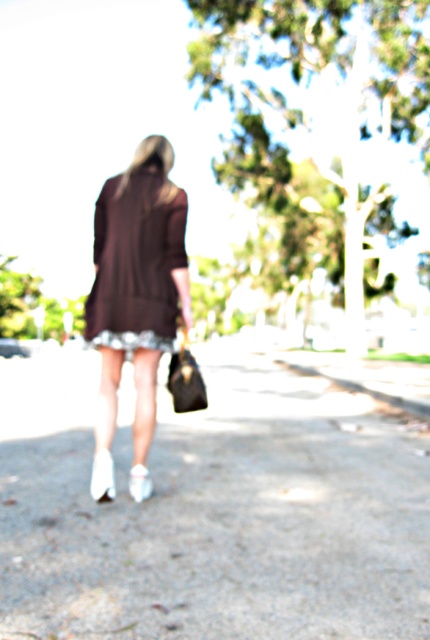
Between white leather shoe at lower center and white leather boot at lower center, which one appears on the left side from the viewer's perspective?

From the viewer's perspective, white leather shoe at lower center appears more on the left side.

Which is more to the right, white leather shoe at lower center or white leather boot at lower center?

Positioned to the right is white leather boot at lower center.

Does point (91, 483) lie in front of point (140, 477)?

No.

You are a GUI agent. You are given a task and a screenshot of the screen. Output one action in this format:
    pyautogui.click(x=<x>, y=<y>)
    Task: Click on the white leather shoe at lower center
    The width and height of the screenshot is (430, 640).
    Given the screenshot: What is the action you would take?
    pyautogui.click(x=103, y=476)

Who is lower down, white smooth pavement at center or matte brown dress at center?

white smooth pavement at center is lower down.

Does white smooth pavement at center lie behind matte brown dress at center?

That is False.

Locate an element on the screen. The image size is (430, 640). white smooth pavement at center is located at coordinates (211, 509).

Can you confirm if matte brown dress at center is shorter than white leather shoe at lower center?

No, matte brown dress at center is not shorter than white leather shoe at lower center.

Which is above, matte brown dress at center or white leather shoe at lower center?

matte brown dress at center is higher up.

Between point (119, 225) and point (106, 451), which one is positioned in front?

Positioned in front is point (106, 451).

Find the location of `matte brown dress at center`. matte brown dress at center is located at coordinates (135, 264).